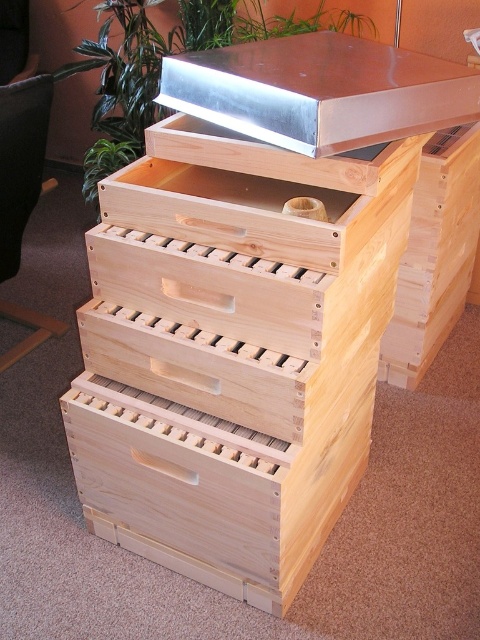
From the picture: Between natural wood crate at center and natural wood crate at right, which one appears on the left side from the viewer's perspective?

Positioned to the left is natural wood crate at center.

Is point (171, 202) less distant than point (450, 317)?

Yes.

Between point (303, 573) and point (451, 266), which one is positioned behind?

Positioned behind is point (451, 266).

Locate an element on the screen. The width and height of the screenshot is (480, 640). natural wood crate at center is located at coordinates (233, 352).

Does metallic silver at upper center appear under natural wood crate at right?

Incorrect, metallic silver at upper center is not positioned below natural wood crate at right.

This screenshot has width=480, height=640. Identify the location of metallic silver at upper center. point(320,92).

How far apart are natural wood crate at center and metallic silver at upper center?

natural wood crate at center and metallic silver at upper center are 14.80 inches apart from each other.

Is point (276, 285) farther from camera compared to point (451, 116)?

No, (276, 285) is closer to viewer.

Is point (206, 429) positioned before point (223, 104)?

No, (206, 429) is behind (223, 104).

What are the coordinates of `natural wood crate at center` in the screenshot? It's located at (233, 352).